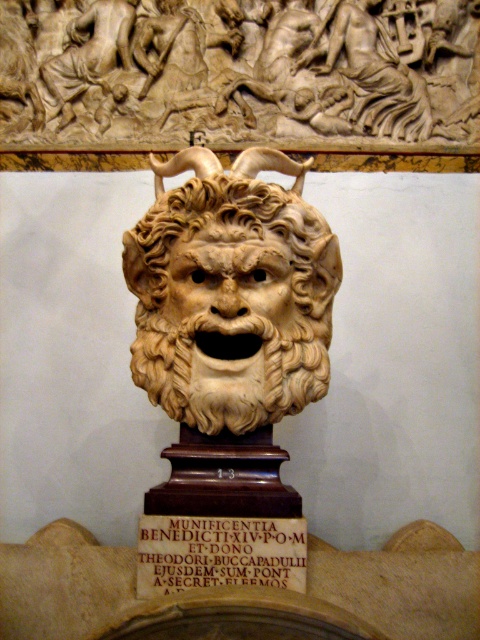
Question: Which of the following is the farthest from the observer?

Choices:
 (A) beige marble lion at center
 (B) carved ivory lion head at center

Answer: (A)

Question: Is beige marble lion at center to the right of carved ivory lion head at center from the viewer's perspective?

Choices:
 (A) yes
 (B) no

Answer: (A)

Question: Observing the image, what is the correct spatial positioning of carved ivory lion head at center in reference to carved stone plaque at center?

Choices:
 (A) right
 (B) left

Answer: (A)

Question: Is beige marble lion at center positioned in front of carved ivory lion head at center?

Choices:
 (A) no
 (B) yes

Answer: (A)

Question: Considering the real-world distances, which object is farthest from the beige marble lion at center?

Choices:
 (A) carved stone plaque at center
 (B) carved ivory lion head at center

Answer: (A)

Question: Which of the following is the closest to the observer?

Choices:
 (A) (253, 285)
 (B) (297, 582)
 (C) (179, 225)

Answer: (B)